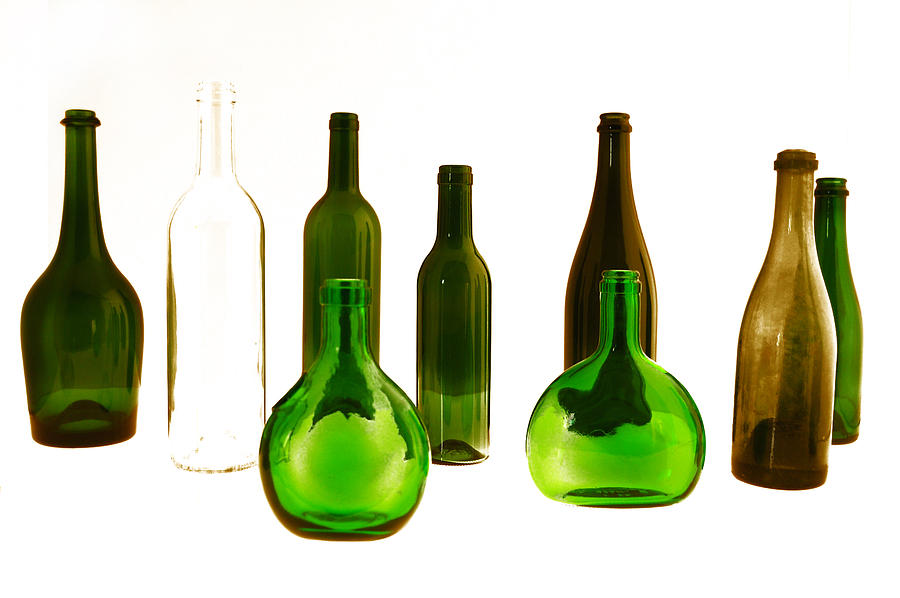
This screenshot has width=900, height=598. What are the coordinates of `bottles` in the screenshot? It's located at (81, 279), (211, 273), (329, 252), (450, 280), (616, 241), (846, 297), (804, 302), (615, 388), (344, 387).